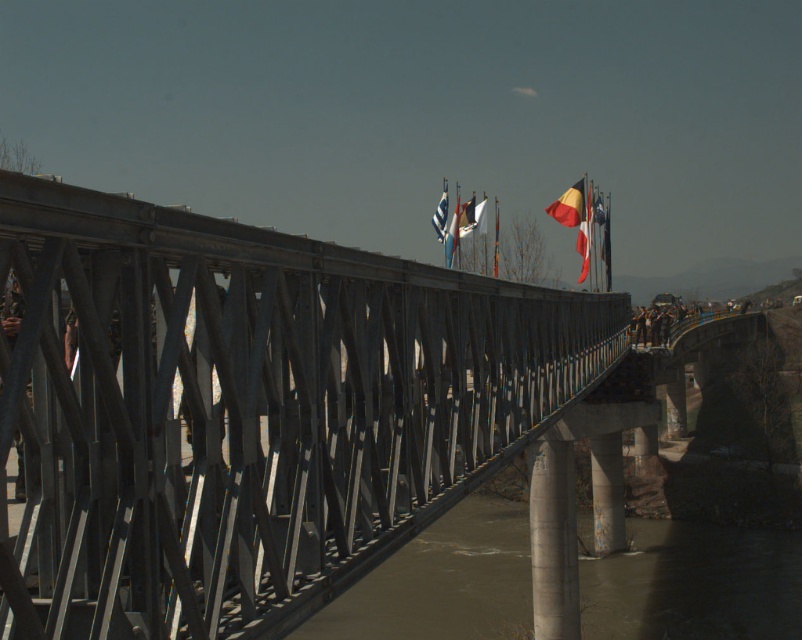
You are a photographer standing on the bridge and want to capture both the brown muddy water at center and the red and yellow striped flag at center in a single shot. Which object will appear closer to the bottom of your photo?

The brown muddy water at center is shorter than the red and yellow striped flag at center, so in the photo, the brown muddy water at center will appear closer to the bottom.

From the picture: You are a photographer standing on the metal bridge. You want to capture a photo where the brown muddy water at center is clearly visible alongside the red and yellow striped flag at center. Based on their sizes, which object should you focus on to ensure both are in frame?

The brown muddy water at center has a larger width than the red and yellow striped flag at center, so focusing on the brown muddy water at center will ensure both are in frame since it occupies more space.

You are a bird flying over the bridge and want to land on the red and yellow striped flag at center. Can you see the brown muddy water at center from your landing spot?

The brown muddy water at center is located below the red and yellow striped flag at center, so yes, you can see the brown muddy water at center from the landing spot on the red and yellow striped flag at center.